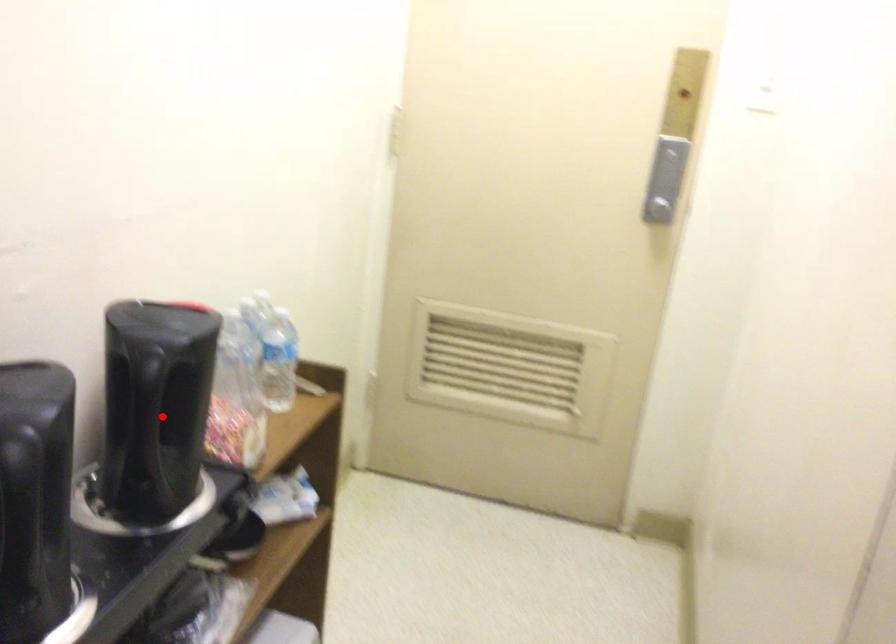
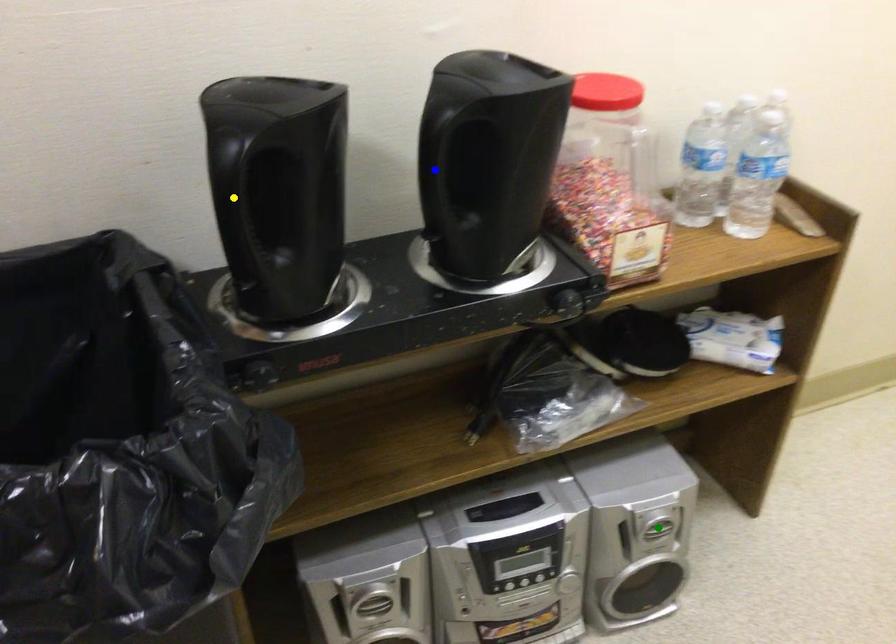
Question: I am providing you with two images of the same scene from different viewpoints. A red point is marked on the first image. You are given multiple points on the second image. Which point in image 2 represents the same 3d spot as the red point in image 1?

Choices:
 (A) green point
 (B) blue point
 (C) yellow point

Answer: (B)